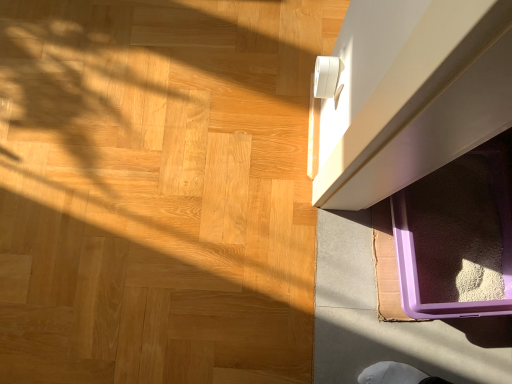
What do you see at coordinates (158, 190) in the screenshot? The height and width of the screenshot is (384, 512). I see `purple plastic tray at lower right` at bounding box center [158, 190].

Locate an element on the screen. purple plastic tray at lower right is located at coordinates (158, 190).

This screenshot has height=384, width=512. I want to click on purple plastic tray at lower right, so click(x=158, y=190).